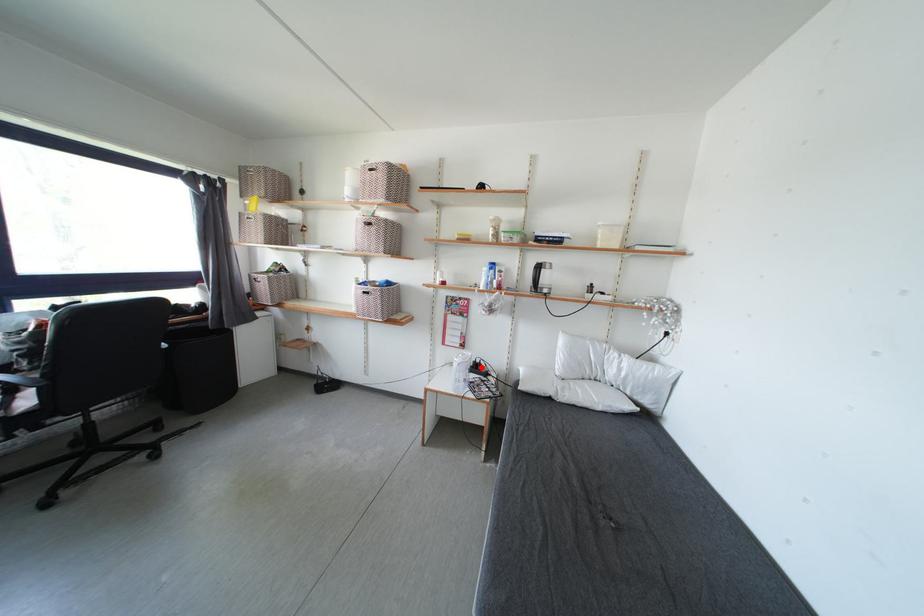
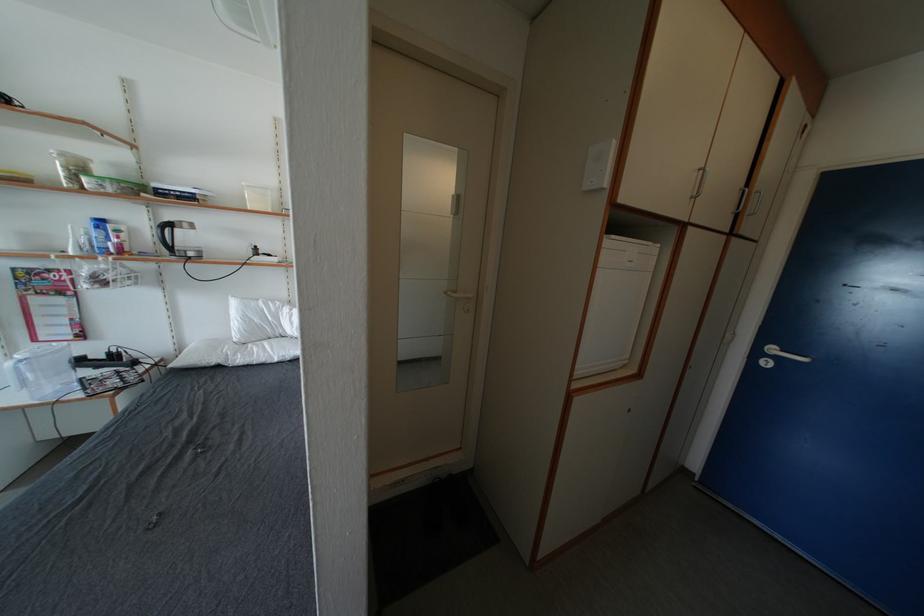
Locate, in the second image, the point that corresponds to the highlighted location in the first image.

(116, 359)